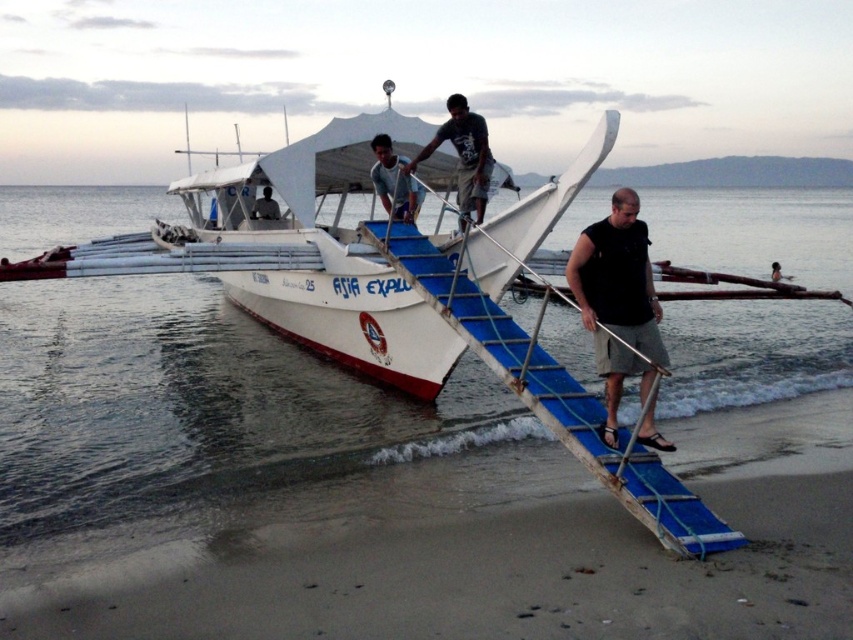
Question: Does blue plastic ladder at center appear on the left side of black fabric shirt at center?

Choices:
 (A) yes
 (B) no

Answer: (A)

Question: Which is nearer to the black fabric shirt at center?

Choices:
 (A) clear water at lower left
 (B) blue plastic ramp at lower center
 (C) blue plastic ladder at center

Answer: (C)

Question: Does blue plastic ladder at center appear on the right side of light blue fabric shirt at center?

Choices:
 (A) no
 (B) yes

Answer: (B)

Question: Which point appears closest to the camera in this image?

Choices:
 (A) (378, 156)
 (B) (260, 202)
 (C) (846, 552)
 (D) (624, 372)

Answer: (C)

Question: Which of the following is the closest to the observer?

Choices:
 (A) (657, 502)
 (B) (544, 541)

Answer: (A)

Question: Considering the relative positions of dark blue shirt at center and matte black shirt at upper center in the image provided, where is dark blue shirt at center located with respect to matte black shirt at upper center?

Choices:
 (A) left
 (B) right

Answer: (B)